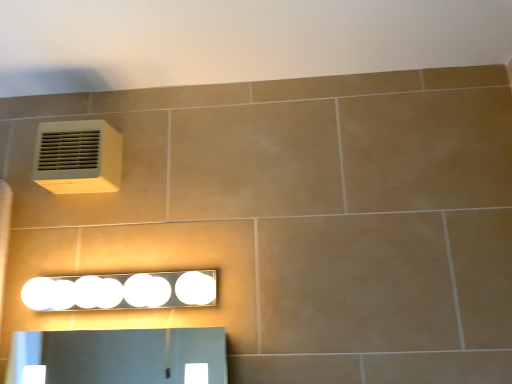
Question: Does white glossy light fixture at lower center turn towards beige tile at upper center?

Choices:
 (A) no
 (B) yes

Answer: (A)

Question: Is white glossy light fixture at lower center bigger than beige tile at upper center?

Choices:
 (A) yes
 (B) no

Answer: (B)

Question: Considering the relative positions of white glossy light fixture at lower center and beige tile at upper center in the image provided, is white glossy light fixture at lower center to the left of beige tile at upper center from the viewer's perspective?

Choices:
 (A) yes
 (B) no

Answer: (A)

Question: From a real-world perspective, is white glossy light fixture at lower center located higher than beige tile at upper center?

Choices:
 (A) no
 (B) yes

Answer: (A)

Question: Is white glossy light fixture at lower center thinner than beige tile at upper center?

Choices:
 (A) yes
 (B) no

Answer: (A)

Question: Is white glossy light fixture at lower center facing away from beige tile at upper center?

Choices:
 (A) yes
 (B) no

Answer: (B)

Question: From a real-world perspective, does beige tile at upper center sit lower than white glossy light fixture at lower center?

Choices:
 (A) no
 (B) yes

Answer: (A)

Question: Is there a large distance between beige tile at upper center and white glossy light fixture at lower center?

Choices:
 (A) yes
 (B) no

Answer: (B)

Question: Does beige tile at upper center turn towards white glossy light fixture at lower center?

Choices:
 (A) yes
 (B) no

Answer: (B)

Question: Is white glossy light fixture at lower center inside beige tile at upper center?

Choices:
 (A) no
 (B) yes

Answer: (A)

Question: Does beige tile at upper center come in front of white glossy light fixture at lower center?

Choices:
 (A) no
 (B) yes

Answer: (B)

Question: Can you confirm if beige tile at upper center is positioned to the left of white glossy light fixture at lower center?

Choices:
 (A) no
 (B) yes

Answer: (A)

Question: From the image's perspective, is white plastic air conditioning unit at upper left below white glossy light fixture at lower center?

Choices:
 (A) no
 (B) yes

Answer: (A)